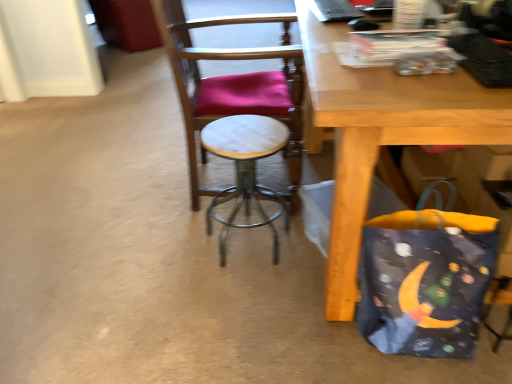
This screenshot has height=384, width=512. I want to click on white marble stool at center, so click(245, 171).

Identify the location of white marble stool at center. (245, 171).

Locate an element on the screen. The height and width of the screenshot is (384, 512). grocery bag lying in front of the white marble stool at center is located at coordinates (426, 279).

Are white marble stool at center and dark blue fabric bag at lower right making contact?

No, white marble stool at center is not making contact with dark blue fabric bag at lower right.

Between white marble stool at center and dark blue fabric bag at lower right, which one is positioned in front?

dark blue fabric bag at lower right is in front.

From the image's perspective, does white marble stool at center appear lower than dark blue fabric bag at lower right?

No, from the image's perspective, white marble stool at center is not beneath dark blue fabric bag at lower right.

Is point (411, 285) in front of point (194, 141)?

That is True.

From the image's perspective, which is above, dark blue fabric bag at lower right or marble seat at center?

marble seat at center, from the image's perspective.

Who is more distant, dark blue fabric bag at lower right or marble seat at center?

marble seat at center is more distant.

In terms of width, does dark blue fabric bag at lower right look wider or thinner when compared to marble seat at center?

In the image, dark blue fabric bag at lower right appears to be more narrow than marble seat at center.

Looking at the image, does marble seat at center seem bigger or smaller compared to dark blue fabric bag at lower right?

In the image, marble seat at center appears to be larger than dark blue fabric bag at lower right.

From the image's perspective, would you say marble seat at center is positioned over dark blue fabric bag at lower right?

Yes, from the image's perspective, marble seat at center is on top of dark blue fabric bag at lower right.

Based on the photo, can we say marble seat at center lies outside dark blue fabric bag at lower right?

marble seat at center lies outside dark blue fabric bag at lower right's area.

Is there a large distance between marble seat at center and dark blue fabric bag at lower right?

No, marble seat at center is not far from dark blue fabric bag at lower right.

Is marble seat at center directly adjacent to white marble stool at center?

No, marble seat at center is not in contact with white marble stool at center.

Relative to white marble stool at center, is marble seat at center in front or behind?

In the image, marble seat at center appears behind white marble stool at center.

Visually, is marble seat at center positioned to the left or to the right of white marble stool at center?

In the image, marble seat at center appears on the left side of white marble stool at center.

Is marble seat at center bigger or smaller than white marble stool at center?

Clearly, marble seat at center is larger in size than white marble stool at center.

How different are the orientations of dark blue fabric bag at lower right and white marble stool at center in degrees?

There is a 94.6-degree angle between the facing directions of dark blue fabric bag at lower right and white marble stool at center.

From the image's perspective, who appears lower, dark blue fabric bag at lower right or white marble stool at center?

dark blue fabric bag at lower right appears lower in the image.

Looking at this image, does dark blue fabric bag at lower right have a larger size compared to white marble stool at center?

Correct, dark blue fabric bag at lower right is larger in size than white marble stool at center.

Is dark blue fabric bag at lower right looking in the opposite direction of white marble stool at center?

No, dark blue fabric bag at lower right's orientation is not away from white marble stool at center.

From the image's perspective, between white marble stool at center and marble seat at center, who is located below?

white marble stool at center appears lower in the image.

Which is more to the right, white marble stool at center or marble seat at center?

white marble stool at center.

Which is nearer, (x=214, y=142) or (x=272, y=81)?

The point (x=214, y=142) is more forward.

Looking at their sizes, would you say white marble stool at center is wider or thinner than marble seat at center?

In the image, white marble stool at center appears to be more narrow than marble seat at center.

Where is `grocery bag that appears in front of the white marble stool at center`? grocery bag that appears in front of the white marble stool at center is located at coordinates (426, 279).

This screenshot has width=512, height=384. Find the location of `chair located above the dark blue fabric bag at lower right (from a real-world perspective)`. chair located above the dark blue fabric bag at lower right (from a real-world perspective) is located at coordinates (232, 83).

Which object lies further to the anchor point marble seat at center, white marble stool at center or dark blue fabric bag at lower right?

The object further to marble seat at center is dark blue fabric bag at lower right.

Which object lies nearer to the anchor point white marble stool at center, marble seat at center or dark blue fabric bag at lower right?

marble seat at center lies closer to white marble stool at center than the other object.

When comparing their distances from dark blue fabric bag at lower right, does white marble stool at center or marble seat at center seem further?

marble seat at center is positioned further to the anchor dark blue fabric bag at lower right.

Considering their positions, is marble seat at center positioned closer to dark blue fabric bag at lower right than white marble stool at center?

Based on the image, white marble stool at center appears to be nearer to dark blue fabric bag at lower right.

Looking at the image, which one is located closer to marble seat at center, dark blue fabric bag at lower right or white marble stool at center?

Among the two, white marble stool at center is located nearer to marble seat at center.

Based on their spatial positions, is dark blue fabric bag at lower right or marble seat at center further from white marble stool at center?

Among the two, dark blue fabric bag at lower right is located further to white marble stool at center.

Locate an element on the screen. The height and width of the screenshot is (384, 512). stool that lies between marble seat at center and dark blue fabric bag at lower right from top to bottom is located at coordinates (245, 171).